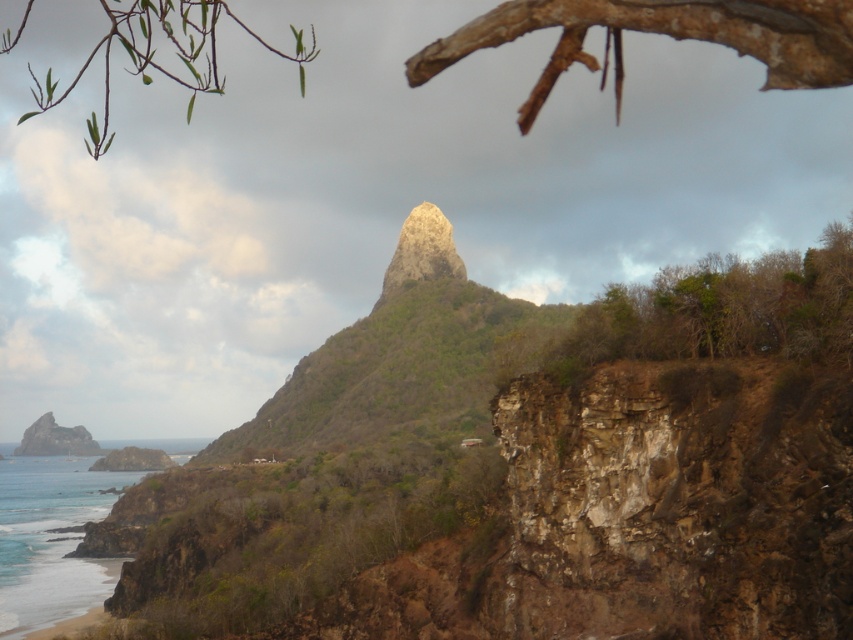
Between point (97, 604) and point (48, 428), which one is positioned behind?

Positioned behind is point (48, 428).

Who is shorter, blue water at lower left or rusty metallic rock at lower left?

Standing shorter between the two is blue water at lower left.

Is point (26, 500) farther from viewer compared to point (33, 442)?

No, (26, 500) is closer to viewer.

The height and width of the screenshot is (640, 853). What are the coordinates of `blue water at lower left` in the screenshot? It's located at (51, 540).